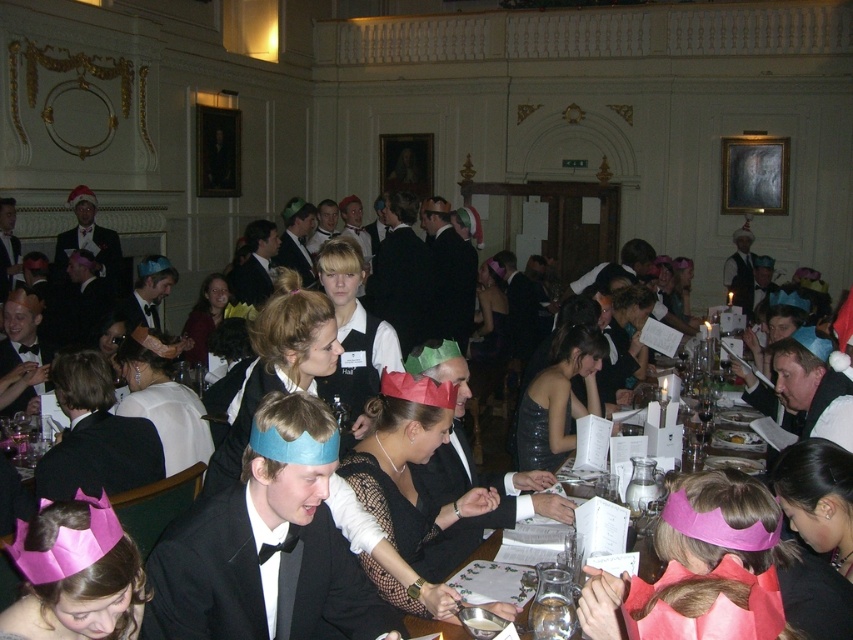
You are planning to place a new pink paper crown on the table in the scene. Given the existing pink paper crown at lower left and the pink paper crown at center, which one should you choose as a reference for size if you want the new crown to be smaller than both?

The pink paper crown at lower left occupies less space than the pink paper crown at center, so you should choose the pink paper crown at lower left as the reference to ensure the new crown is smaller than both.

You are standing at the balcony in the elegant room and want to take a photo. There are two points marked in the image, point A at coordinates point (x=113, y=612) and point B at coordinates point (x=440, y=548). Which point should you focus on to ensure it appears larger in your photo?

Point A at coordinates point (x=113, y=612) should be focused on because it is closer to the camera and will appear larger in the photo compared to point B at coordinates point (x=440, y=548).